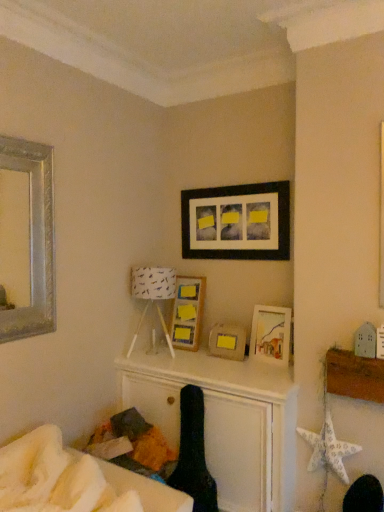
At what (x,y) coordinates should I click in order to perform the action: click on vacant region above wooden frame with sticky notes at upper center, arranged as the fourth picture frame when viewed from the right (from a real-world perspective). Please return your answer as a coordinate pair (x, y). The image size is (384, 512). Looking at the image, I should click on (197, 269).